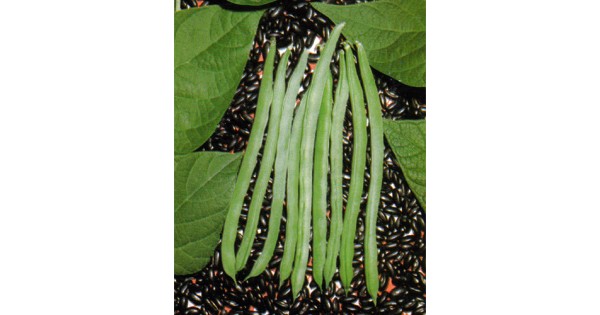
The width and height of the screenshot is (600, 315). I want to click on orange table surface, so click(x=261, y=57), click(x=313, y=64).